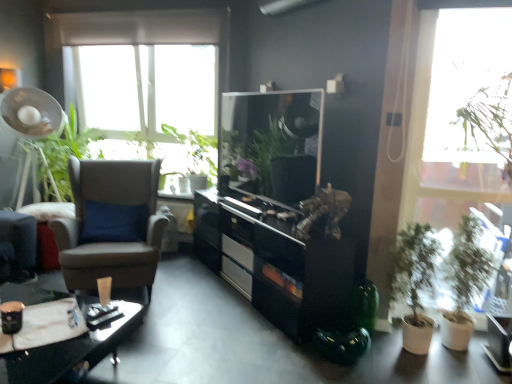
What do you see at coordinates (275, 262) in the screenshot? The image size is (512, 384). I see `black glossy cabinet at center` at bounding box center [275, 262].

Describe the element at coordinates (64, 157) in the screenshot. The image size is (512, 384). I see `green leafy plant at left, which ranks as the second vegetation in right-to-left order` at that location.

At what (x,y) coordinates should I click in order to perform the action: click on green matte plant at right, placed as the 2th houseplant when sorted from right to left. Please return your answer as a coordinate pair (x, y). The height and width of the screenshot is (384, 512). Looking at the image, I should click on (414, 282).

Where is `green leafy plant at upper center, arranged as the second vegetation when viewed from the left`? The height and width of the screenshot is (384, 512). green leafy plant at upper center, arranged as the second vegetation when viewed from the left is located at coordinates coord(196,151).

Measure the distance between point (128, 253) and camera.

The distance of point (128, 253) from camera is 9.90 feet.

Where is `transparent glass window at upper right`? Image resolution: width=512 pixels, height=384 pixels. transparent glass window at upper right is located at coordinates (420, 117).

From a real-world perspective, which object rests below the other?

In real-world perspective, matte black desk at lower left is lower.

Which object is positioned more to the right, black glossy cabinet at center or matte black desk at lower left?

black glossy cabinet at center is more to the right.

Which is behind, black glossy cabinet at center or matte black desk at lower left?

black glossy cabinet at center is further from the camera.

Is black glossy cabinet at center beside matte black desk at lower left?

No, black glossy cabinet at center is not making contact with matte black desk at lower left.

Which is correct: green leafy plant at upper center, arranged as the second vegetation when viewed from the left, is inside matte black desk at lower left, or outside of it?

green leafy plant at upper center, arranged as the second vegetation when viewed from the left, is not inside matte black desk at lower left, it's outside.

Who is smaller, green leafy plant at upper center, arranged as the second vegetation when viewed from the left, or matte black desk at lower left?

Smaller between the two is matte black desk at lower left.

Is green leafy plant at upper center, which is the 1th vegetation from right to left, beside matte black desk at lower left?

No, green leafy plant at upper center, which is the 1th vegetation from right to left, is not with matte black desk at lower left.

Can you tell me how much green leafy plant at upper center, which is the 1th vegetation from right to left, and matte black desk at lower left differ in facing direction?

There is a 4.91-degree angle between the facing directions of green leafy plant at upper center, which is the 1th vegetation from right to left, and matte black desk at lower left.

Considering the relative sizes of green leafy plant at upper center, arranged as the second vegetation when viewed from the left, and green matte plant at right, marked as the 2th houseplant in a left-to-right arrangement, in the image provided, is green leafy plant at upper center, arranged as the second vegetation when viewed from the left, bigger than green matte plant at right, marked as the 2th houseplant in a left-to-right arrangement,?

Correct, green leafy plant at upper center, arranged as the second vegetation when viewed from the left, is larger in size than green matte plant at right, marked as the 2th houseplant in a left-to-right arrangement.

Looking at this image, is green leafy plant at upper center, which is the 1th vegetation from right to left, thinner than green matte plant at right, which is counted as the first houseplant, starting from the right?

In fact, green leafy plant at upper center, which is the 1th vegetation from right to left, might be wider than green matte plant at right, which is counted as the first houseplant, starting from the right.

Can you confirm if green leafy plant at upper center, arranged as the second vegetation when viewed from the left, is positioned to the right of green matte plant at right, which is counted as the first houseplant, starting from the right?

No.

From a real-world perspective, does green leafy plant at upper center, arranged as the second vegetation when viewed from the left, sit lower than green matte plant at right, marked as the 2th houseplant in a left-to-right arrangement?

No, from a real-world perspective, green leafy plant at upper center, arranged as the second vegetation when viewed from the left, is not under green matte plant at right, marked as the 2th houseplant in a left-to-right arrangement.

Find the location of a particular element. Image resolution: width=512 pixels, height=384 pixels. chair in front of the green leafy plant at upper center, arranged as the second vegetation when viewed from the left is located at coordinates (113, 240).

How far apart are brown leather chair at left and green leafy plant at upper center, which is the 1th vegetation from right to left?

brown leather chair at left is 3.87 feet from green leafy plant at upper center, which is the 1th vegetation from right to left.

Is brown leather chair at left taller or shorter than green leafy plant at upper center, which is the 1th vegetation from right to left?

brown leather chair at left is taller than green leafy plant at upper center, which is the 1th vegetation from right to left.

From a real-world perspective, who is located higher, brown leather chair at left or green leafy plant at upper center, which is the 1th vegetation from right to left?

green leafy plant at upper center, which is the 1th vegetation from right to left.

From the image's perspective, which object appears higher, green matte plant at right, the 1th houseplant when ordered from left to right, or green matte plant at right, marked as the 2th houseplant in a left-to-right arrangement?

green matte plant at right, marked as the 2th houseplant in a left-to-right arrangement, from the image's perspective.

Does green matte plant at right, the 1th houseplant when ordered from left to right, have a larger size compared to green matte plant at right, which is counted as the first houseplant, starting from the right?

Correct, green matte plant at right, the 1th houseplant when ordered from left to right, is larger in size than green matte plant at right, which is counted as the first houseplant, starting from the right.

Who is taller, green matte plant at right, placed as the 2th houseplant when sorted from right to left, or green matte plant at right, which is counted as the first houseplant, starting from the right?

With more height is green matte plant at right, which is counted as the first houseplant, starting from the right.

Considering the relative sizes of brown leather chair at left and black glossy cabinet at center in the image provided, is brown leather chair at left taller than black glossy cabinet at center?

Yes, brown leather chair at left is taller than black glossy cabinet at center.

Do you think brown leather chair at left is within black glossy cabinet at center, or outside of it?

brown leather chair at left exists outside the volume of black glossy cabinet at center.

Is brown leather chair at left far from black glossy cabinet at center?

No, there isn't a large distance between brown leather chair at left and black glossy cabinet at center.

Does point (130, 257) lie in front of point (297, 304)?

No, (130, 257) is further to viewer.

Where is `window above the black glossy cabinet at center (from a real-world perspective)`? window above the black glossy cabinet at center (from a real-world perspective) is located at coordinates (420, 117).

Does transparent glass window at upper right contain black glossy cabinet at center?

No, black glossy cabinet at center is not surrounded by transparent glass window at upper right.

Considering the relative sizes of transparent glass window at upper right and black glossy cabinet at center in the image provided, is transparent glass window at upper right thinner than black glossy cabinet at center?

Correct, the width of transparent glass window at upper right is less than that of black glossy cabinet at center.

From the image's perspective, is transparent glass window at upper right located beneath black glossy cabinet at center?

No, from the image's perspective, transparent glass window at upper right is not beneath black glossy cabinet at center.

At what (x,y) coordinates should I click in order to perform the action: click on desk in front of the black glossy cabinet at center. Please return your answer as a coordinate pair (x, y). This screenshot has height=384, width=512. Looking at the image, I should click on click(75, 346).

The image size is (512, 384). Identify the location of desk that appears below the green leafy plant at upper center, which is the 1th vegetation from right to left (from a real-world perspective). (75, 346).

Estimate the real-world distances between objects in this image. Which object is further from green matte plant at right, placed as the 2th houseplant when sorted from right to left, brown leather chair at left or green leafy plant at left, the 1th vegetation from the left?

green leafy plant at left, the 1th vegetation from the left, is further to green matte plant at right, placed as the 2th houseplant when sorted from right to left.

From the picture: Looking at the image, which one is located closer to black glossy cabinet at center, green leafy plant at left, which ranks as the second vegetation in right-to-left order, or brown leather chair at left?

Based on the image, brown leather chair at left appears to be nearer to black glossy cabinet at center.

Estimate the real-world distances between objects in this image. Which object is closer to black glossy cabinet at center, matte black desk at lower left or transparent glass window at upper right?

transparent glass window at upper right lies closer to black glossy cabinet at center than the other object.

Estimate the real-world distances between objects in this image. Which object is closer to black glossy cabinet at center, matte black desk at lower left or brown leather chair at left?

brown leather chair at left is closer to black glossy cabinet at center.

Estimate the real-world distances between objects in this image. Which object is closer to transparent glass window at upper right, green matte plant at right, placed as the 2th houseplant when sorted from right to left, or black glossy cabinet at center?

Based on the image, green matte plant at right, placed as the 2th houseplant when sorted from right to left, appears to be nearer to transparent glass window at upper right.

Considering their positions, is green matte plant at right, marked as the 2th houseplant in a left-to-right arrangement, positioned closer to brown leather chair at left than green matte plant at right, the 1th houseplant when ordered from left to right?

green matte plant at right, the 1th houseplant when ordered from left to right, lies closer to brown leather chair at left than the other object.

From the picture: Which object lies nearer to the anchor point green leafy plant at upper center, arranged as the second vegetation when viewed from the left, brown leather chair at left or green leafy plant at left, which ranks as the second vegetation in right-to-left order?

green leafy plant at left, which ranks as the second vegetation in right-to-left order, is positioned closer to the anchor green leafy plant at upper center, arranged as the second vegetation when viewed from the left.

Considering their positions, is transparent glass window at upper right positioned closer to green leafy plant at upper center, which is the 1th vegetation from right to left, than green matte plant at right, which is counted as the first houseplant, starting from the right?

transparent glass window at upper right is closer to green leafy plant at upper center, which is the 1th vegetation from right to left.

This screenshot has width=512, height=384. I want to click on cabinetry situated between brown leather chair at left and green matte plant at right, the 1th houseplant when ordered from left to right, from left to right, so click(275, 262).

Image resolution: width=512 pixels, height=384 pixels. Find the location of `cabinetry situated between green leafy plant at upper center, which is the 1th vegetation from right to left, and green matte plant at right, marked as the 2th houseplant in a left-to-right arrangement, from left to right`. cabinetry situated between green leafy plant at upper center, which is the 1th vegetation from right to left, and green matte plant at right, marked as the 2th houseplant in a left-to-right arrangement, from left to right is located at coordinates (275, 262).

The image size is (512, 384). Find the location of `desk between green leafy plant at left, which ranks as the second vegetation in right-to-left order, and green matte plant at right, marked as the 2th houseplant in a left-to-right arrangement, in the horizontal direction`. desk between green leafy plant at left, which ranks as the second vegetation in right-to-left order, and green matte plant at right, marked as the 2th houseplant in a left-to-right arrangement, in the horizontal direction is located at coordinates (75, 346).

Where is `cabinetry between matte black desk at lower left and green matte plant at right, placed as the 2th houseplant when sorted from right to left, in the horizontal direction`? The height and width of the screenshot is (384, 512). cabinetry between matte black desk at lower left and green matte plant at right, placed as the 2th houseplant when sorted from right to left, in the horizontal direction is located at coordinates click(x=275, y=262).